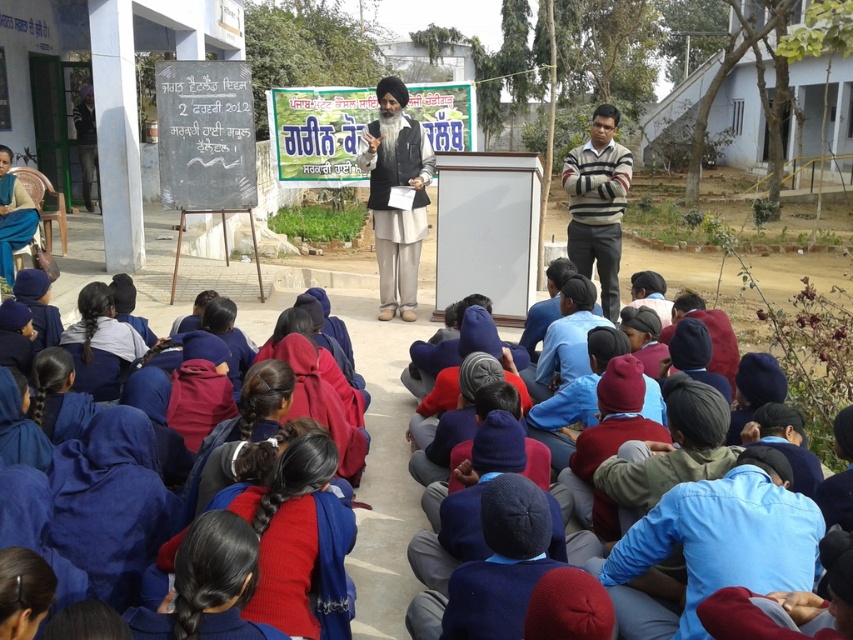
Is black chalkboard at upper center to the right of light beige fabric turban at center from the viewer's perspective?

Incorrect, black chalkboard at upper center is not on the right side of light beige fabric turban at center.

What do you see at coordinates (206, 134) in the screenshot? I see `black chalkboard at upper center` at bounding box center [206, 134].

Identify the location of black chalkboard at upper center. Image resolution: width=853 pixels, height=640 pixels. (206, 134).

Does light beige fabric turban at center appear on the right side of striped sweater at right?

No, light beige fabric turban at center is not to the right of striped sweater at right.

This screenshot has height=640, width=853. I want to click on light beige fabric turban at center, so click(x=387, y=193).

Which is in front, point (654, 529) or point (601, 252)?

Point (654, 529)

Does blue cotton shirt at lower right appear on the right side of striped sweater at right?

No, blue cotton shirt at lower right is not to the right of striped sweater at right.

Does point (788, 572) come farther from viewer compared to point (582, 264)?

No.

Locate an element on the screen. This screenshot has height=640, width=853. blue cotton shirt at lower right is located at coordinates click(x=720, y=540).